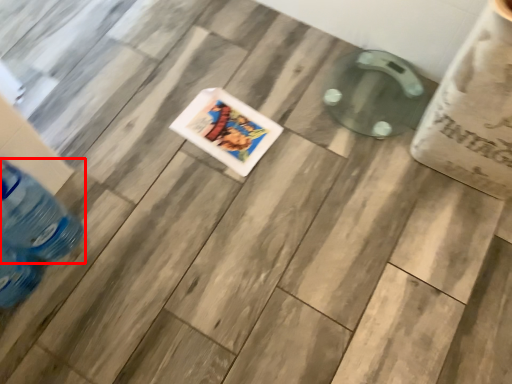
Question: From the image's perspective, where is bottle (annotated by the red box) located relative to comic book?

Choices:
 (A) above
 (B) below

Answer: (B)